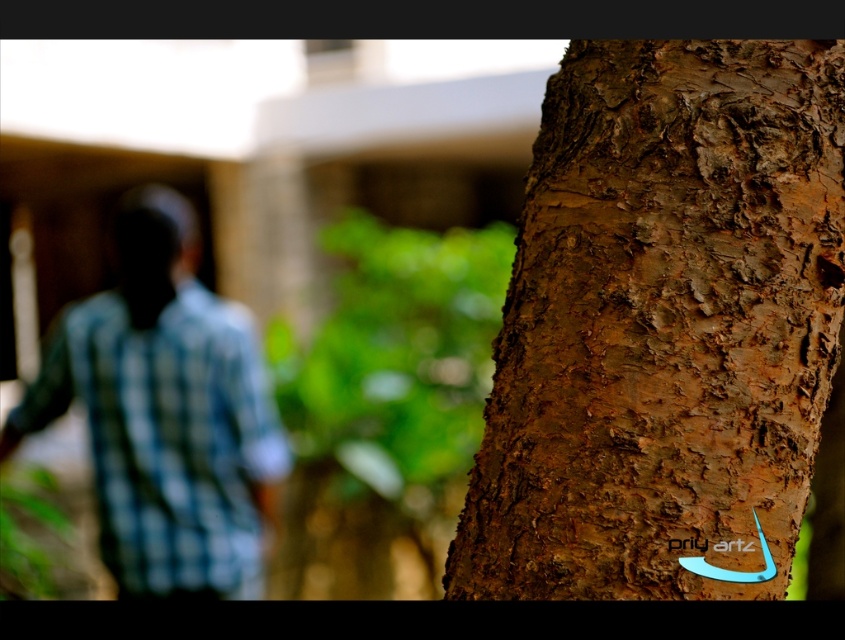
Question: Does brown rough bark at right have a larger size compared to blue checkered shirt at left?

Choices:
 (A) yes
 (B) no

Answer: (B)

Question: In this image, where is brown rough bark at right located relative to blue checkered shirt at left?

Choices:
 (A) left
 (B) right

Answer: (B)

Question: From the image, what is the correct spatial relationship of brown rough bark at right in relation to blue checkered shirt at left?

Choices:
 (A) right
 (B) left

Answer: (A)